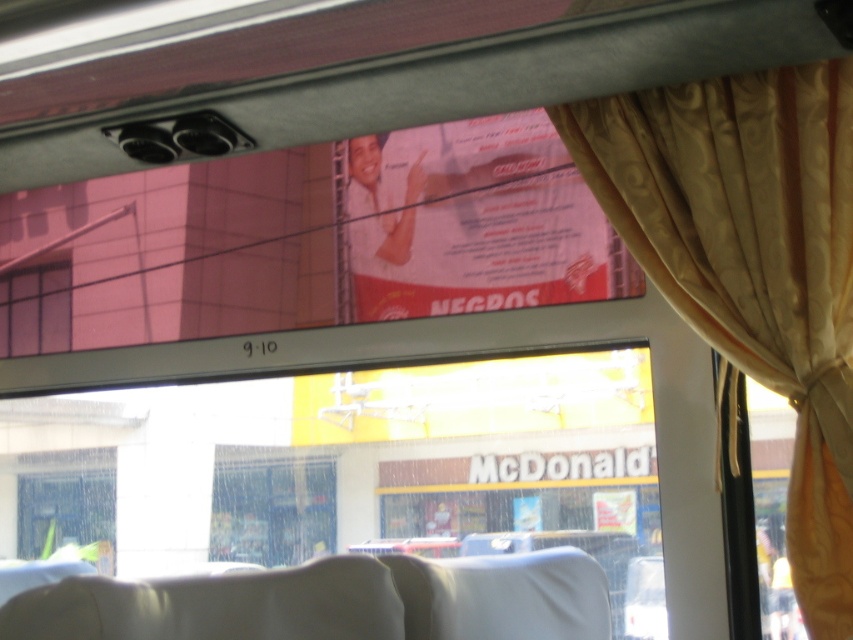
You are a passenger on a bus and you notice two items in the window area of the bus. The red glossy poster at upper center and the pink glass window at upper left. Which one is positioned further to the right from your perspective?

The red glossy poster at upper center is positioned to the right of the pink glass window at upper left, so it is further to the right.

You are a passenger on a bus and notice two items in the window area. The gold satin curtain at right and the pink glass window at upper left. Which item is closer to the top of the window frame?

The pink glass window at upper left is closer to the top of the window frame because the gold satin curtain at right is positioned under it.